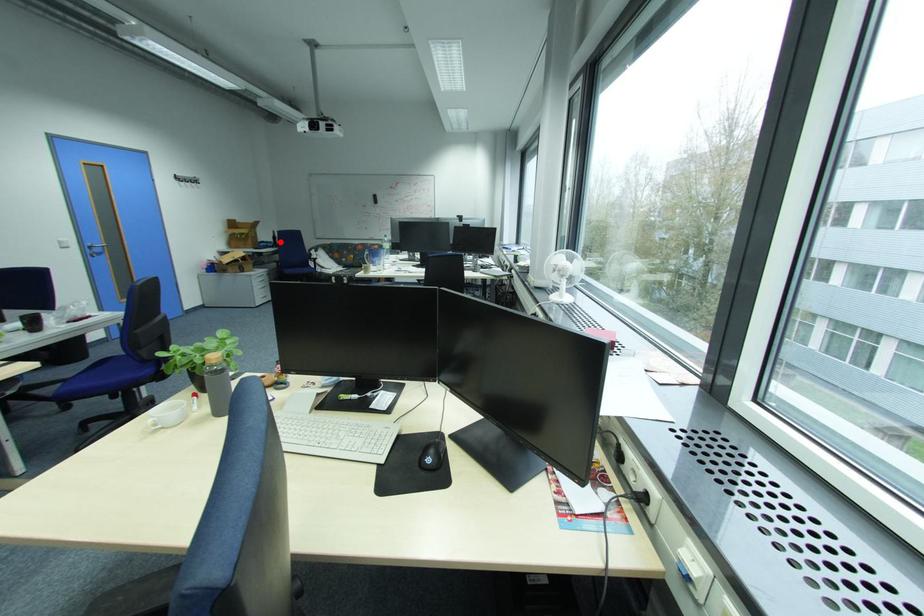
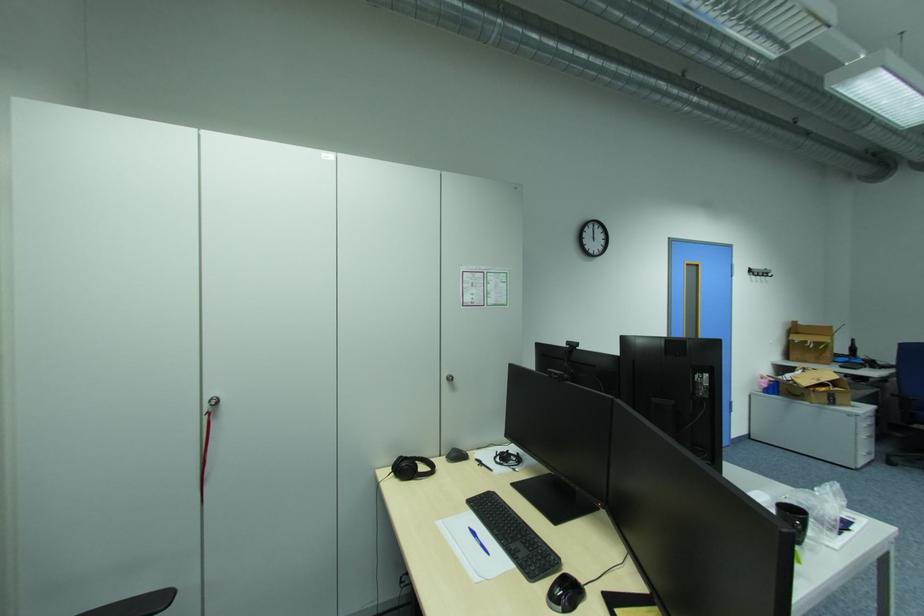
Question: A red point is marked in image1. In image2, is the corresponding 3D point closer to the camera or farther? Reply with the corresponding letter.

Choices:
 (A) The corresponding 3D point is closer.
 (B) The corresponding 3D point is farther.

Answer: (B)